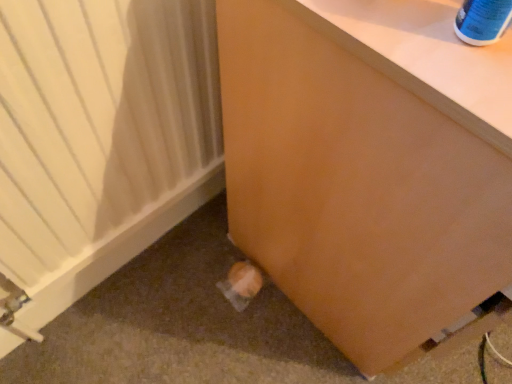
Question: In terms of height, does white matte heater at lower left look taller or shorter compared to matte brown drawer at lower right?

Choices:
 (A) short
 (B) tall

Answer: (A)

Question: Choose the correct answer: Is white matte heater at lower left inside matte brown drawer at lower right or outside it?

Choices:
 (A) outside
 (B) inside

Answer: (A)

Question: Considering the positions of white matte heater at lower left and matte brown drawer at lower right in the image, is white matte heater at lower left wider or thinner than matte brown drawer at lower right?

Choices:
 (A) wide
 (B) thin

Answer: (B)

Question: Would you say matte brown drawer at lower right is to the left or to the right of white matte heater at lower left in the picture?

Choices:
 (A) right
 (B) left

Answer: (A)

Question: From a real-world perspective, relative to white matte heater at lower left, is matte brown drawer at lower right vertically above or below?

Choices:
 (A) below
 (B) above

Answer: (B)

Question: From the image's perspective, is matte brown drawer at lower right positioned above or below white matte heater at lower left?

Choices:
 (A) below
 (B) above

Answer: (B)

Question: In terms of width, does matte brown drawer at lower right look wider or thinner when compared to white matte heater at lower left?

Choices:
 (A) thin
 (B) wide

Answer: (B)